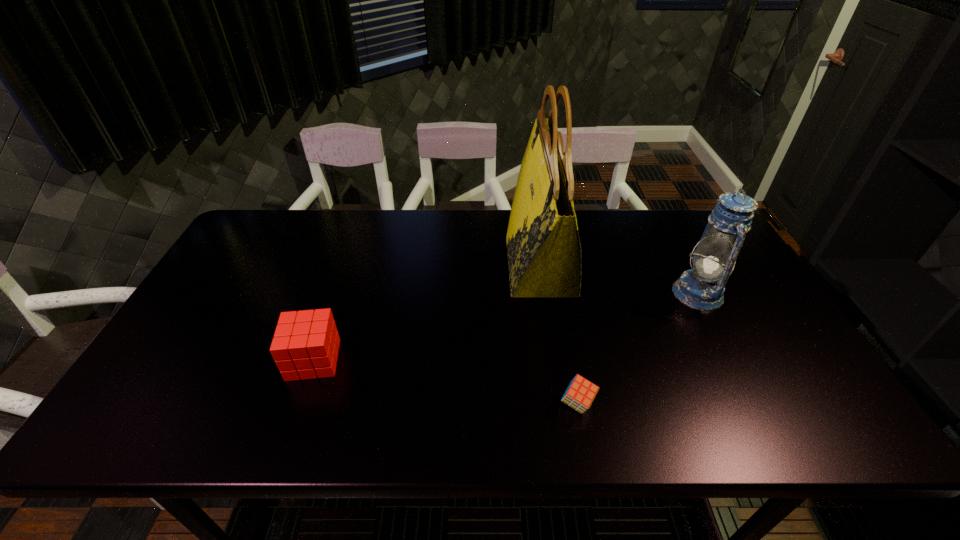
What are the coordinates of `the tallest object` in the screenshot? It's located at (544, 252).

At what (x,y) coordinates should I click in order to perform the action: click on the second tallest object. Please return your answer as a coordinate pair (x, y). The image size is (960, 540). Looking at the image, I should click on (702, 287).

Locate an element on the screen. lantern is located at coordinates (702, 287).

Find the location of a particular element. This screenshot has height=540, width=960. the second nearest object is located at coordinates [305, 346].

Locate an element on the screen. The width and height of the screenshot is (960, 540). the farther cube is located at coordinates (305, 346).

The image size is (960, 540). I want to click on the nearer cube, so click(x=580, y=393).

At what (x,y) coordinates should I click in order to perform the action: click on the shortest object. Please return your answer as a coordinate pair (x, y). This screenshot has width=960, height=540. Looking at the image, I should click on (580, 393).

I want to click on vacant space located 0.240m on the front-facing side of the tallest object, so [x=430, y=265].

This screenshot has width=960, height=540. Find the location of `free spot located 0.330m on the front-facing side of the tallest object`. free spot located 0.330m on the front-facing side of the tallest object is located at coordinates (401, 265).

Where is `blank space located 0.240m on the front-facing side of the tallest object`? Image resolution: width=960 pixels, height=540 pixels. blank space located 0.240m on the front-facing side of the tallest object is located at coordinates (430, 265).